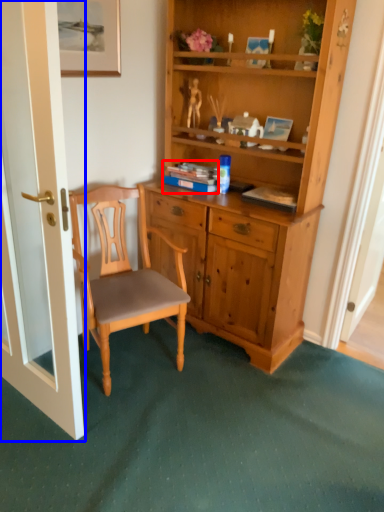
Question: Among these objects, which one is nearest to the camera, book (highlighted by a red box) or door (highlighted by a blue box)?

Choices:
 (A) book
 (B) door

Answer: (B)